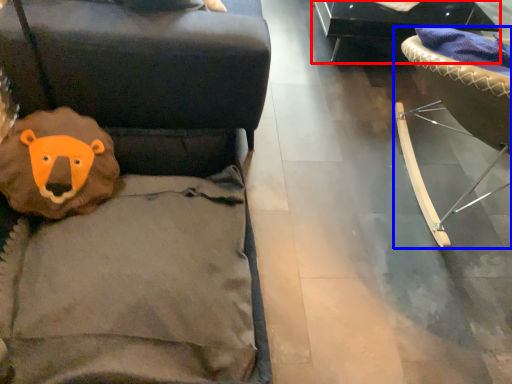
Question: Which point is closer to the camera, furniture (highlighted by a red box) or furniture (highlighted by a blue box)?

Choices:
 (A) furniture
 (B) furniture

Answer: (B)